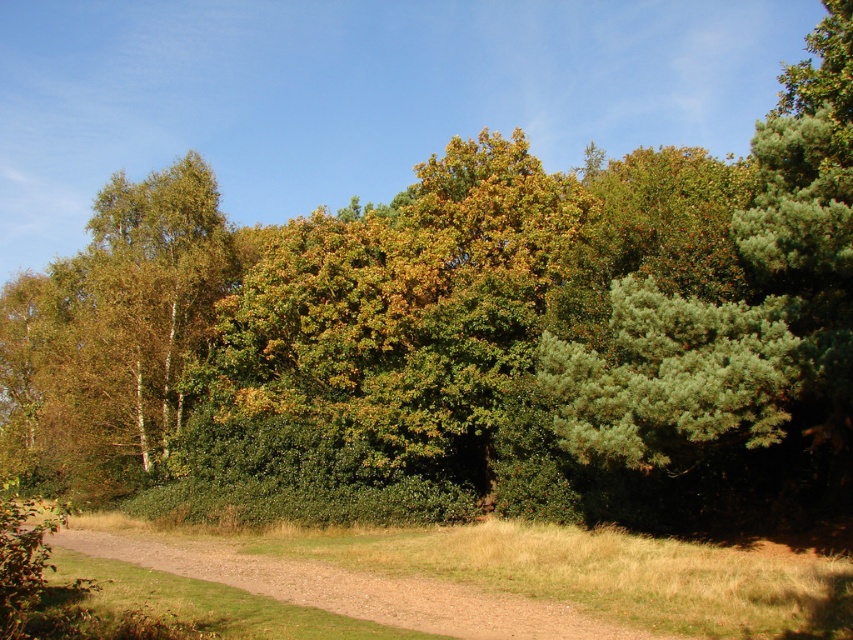
You are standing at the edge of the forest and see the green leafy tree at left and the brown gravel path at lower center. Which object is located to the east of the other?

The green leafy tree at left is positioned on the left side of brown gravel path at lower center, so the green leafy tree at left is to the east of the brown gravel path at lower center.

You are standing in the middle of the forest depicted in the scene. You see two points marked in the image. Which point, point (341, 250) or point (97, 316), is closer to you?

Point (341, 250) is closer to the viewer than point (97, 316).

You are standing at the center of the scene and want to walk towards the green leafy tree at left. Which direction should you face to head directly towards it?

The green leafy tree at left is located at point (113, 337), which means it is positioned to the left and slightly forward from your current position at the center. To head directly towards it, you should face towards the left direction.